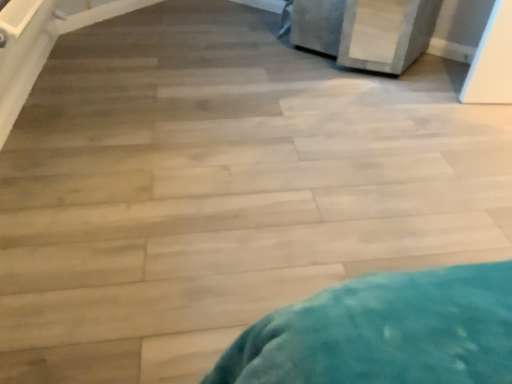
The height and width of the screenshot is (384, 512). Describe the element at coordinates (366, 31) in the screenshot. I see `matte gray cube at upper right` at that location.

Locate an element on the screen. The width and height of the screenshot is (512, 384). matte gray cube at upper right is located at coordinates (366, 31).

This screenshot has width=512, height=384. What are the coordinates of `matte gray cube at upper right` in the screenshot? It's located at (366, 31).